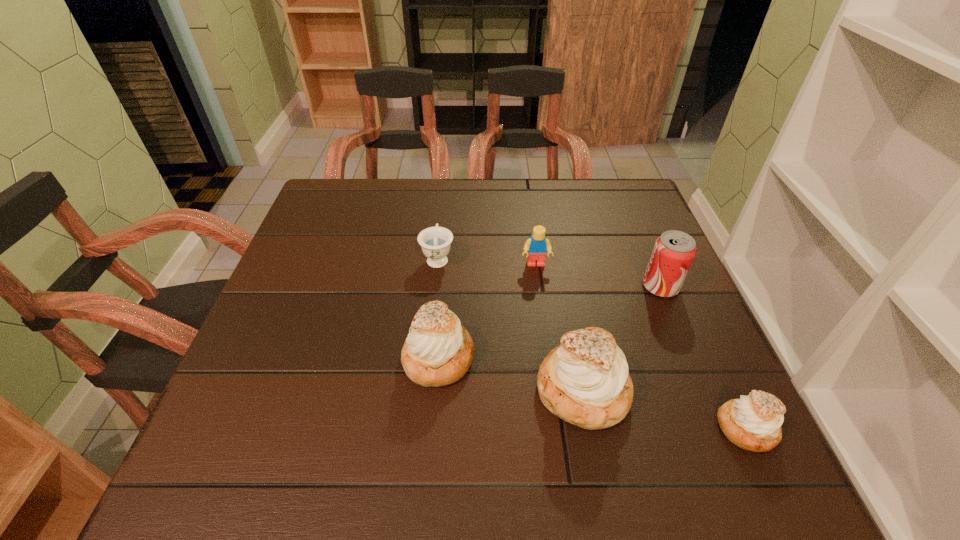
Please point a spot on the left to add another pastry. Please provide its 2D coordinates. Your answer should be formatted as a tuple, i.e. [(x, y)], where the tuple contains the x and y coordinates of a point satisfying the conditions above.

[(311, 328)]